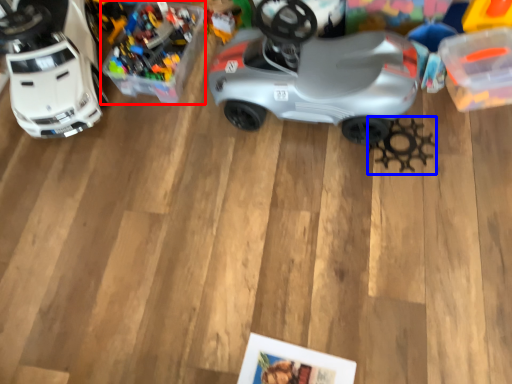
Question: Which object is further to the camera taking this photo, toy (highlighted by a red box) or toy (highlighted by a blue box)?

Choices:
 (A) toy
 (B) toy

Answer: (B)